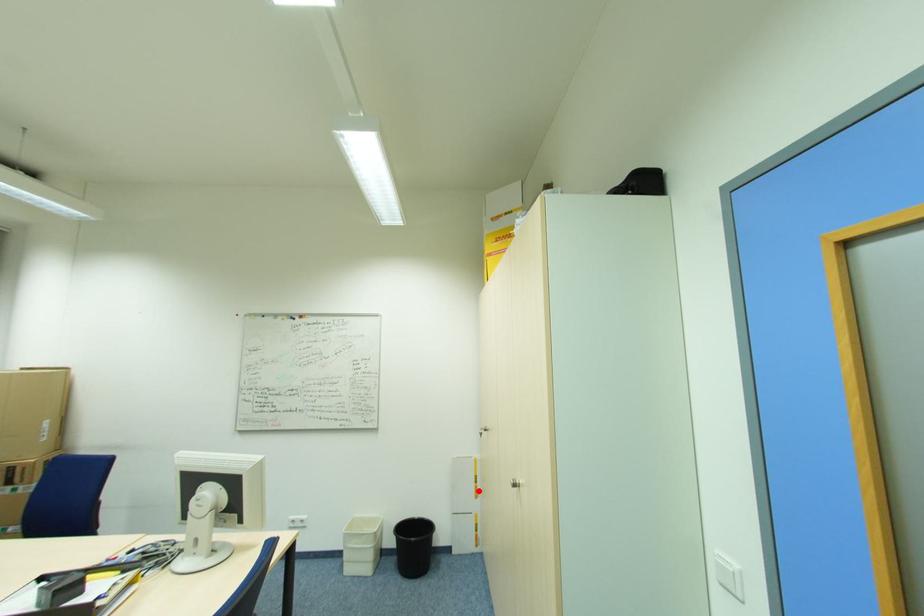
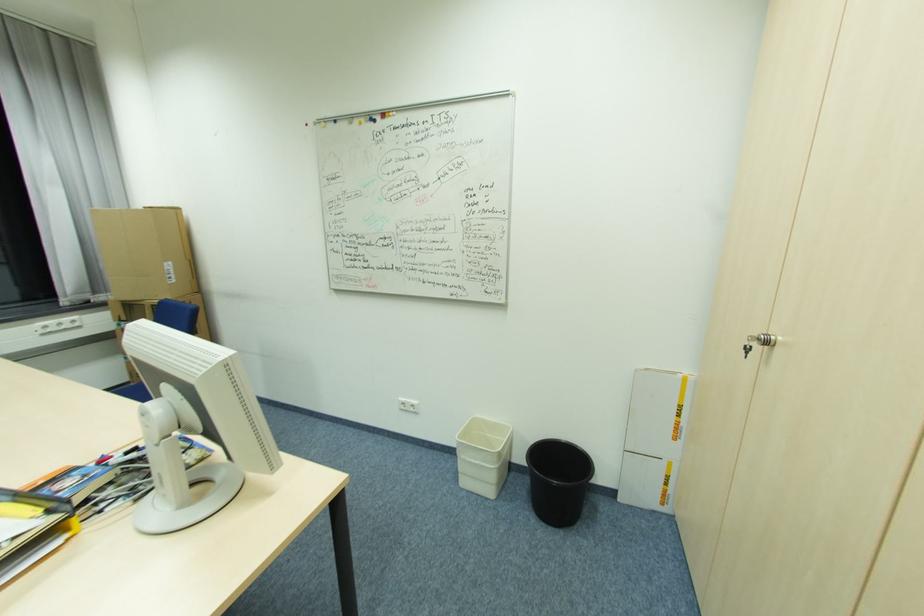
Question: I am providing you with two images of the same scene from different viewpoints. In image1, a red point is highlighted. Considering the same 3D point in image2, which of the following is correct?

Choices:
 (A) It is closer
 (B) It is farther

Answer: (A)